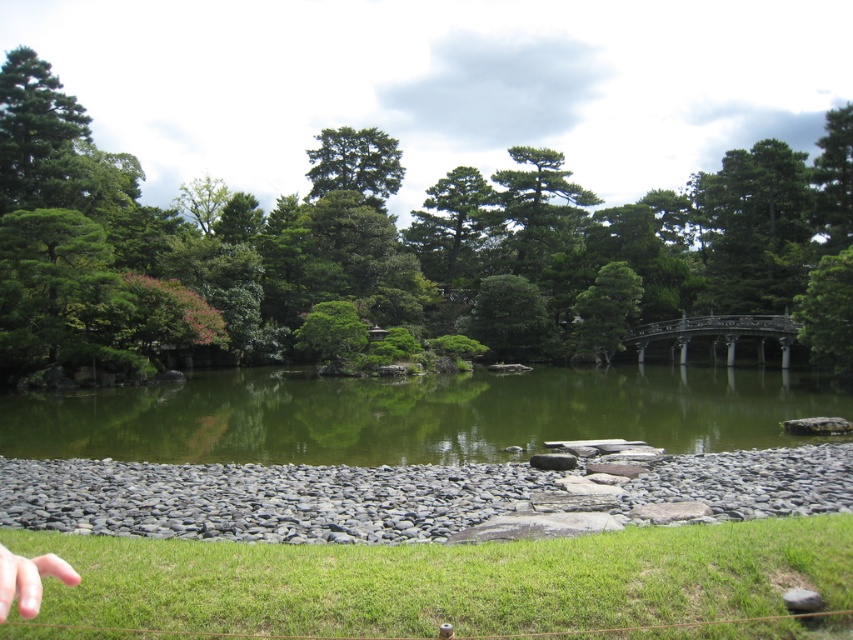
Question: Among these points, which one is farthest from the camera?

Choices:
 (A) (41, 593)
 (B) (474, 428)

Answer: (B)

Question: Among these points, which one is farthest from the camera?

Choices:
 (A) (15, 284)
 (B) (0, 570)
 (C) (372, 182)

Answer: (C)

Question: Is green leafy tree at center to the left of green matte tree at upper center from the viewer's perspective?

Choices:
 (A) yes
 (B) no

Answer: (B)

Question: Estimate the real-world distances between objects in this image. Which object is closer to the green matte tree at upper center?

Choices:
 (A) green leafy tree at center
 (B) green smooth water at center
 (C) pale skin finger at lower left

Answer: (A)

Question: Can you confirm if green smooth water at center is smaller than green matte tree at upper center?

Choices:
 (A) yes
 (B) no

Answer: (A)

Question: Can you confirm if green smooth water at center is thinner than green matte tree at upper center?

Choices:
 (A) no
 (B) yes

Answer: (A)